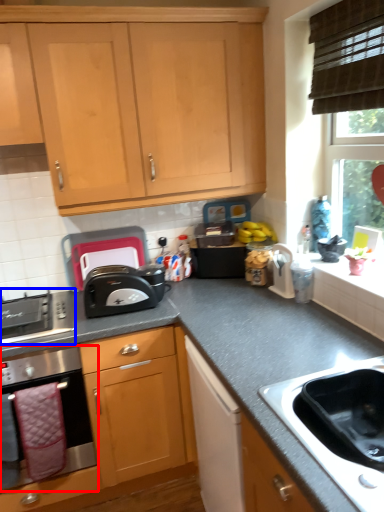
Question: Which object is closer to the camera taking this photo, kitchen appliance (highlighted by a red box) or gas stove (highlighted by a blue box)?

Choices:
 (A) kitchen appliance
 (B) gas stove

Answer: (A)